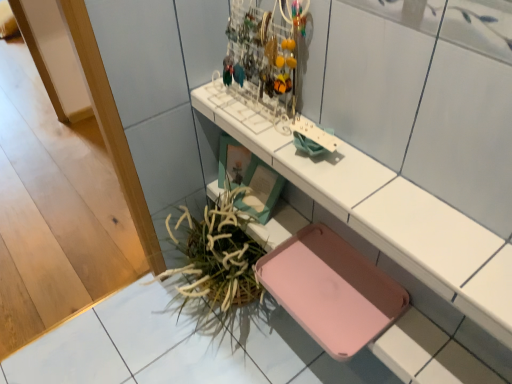
Identify the location of empty space that is ontop of pink plastic tray at upper center (from a real-world perspective). The image size is (512, 384). (335, 167).